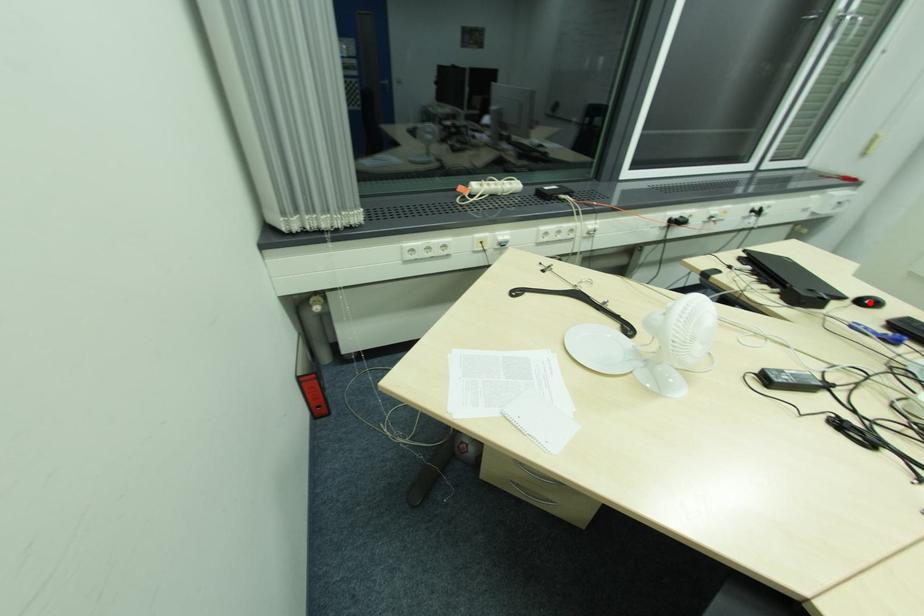
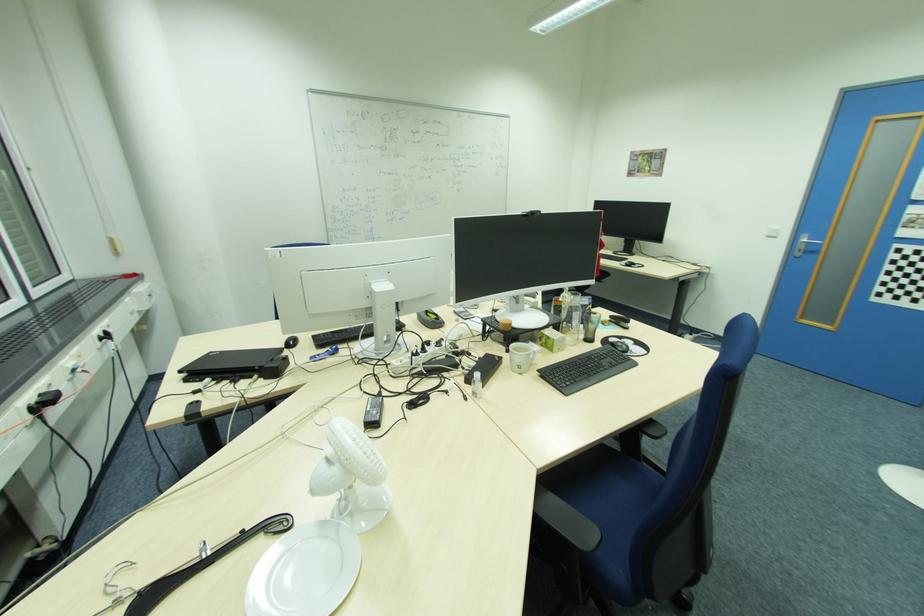
In the second image, find the point that corresponds to the highlighted location in the first image.

(294, 344)